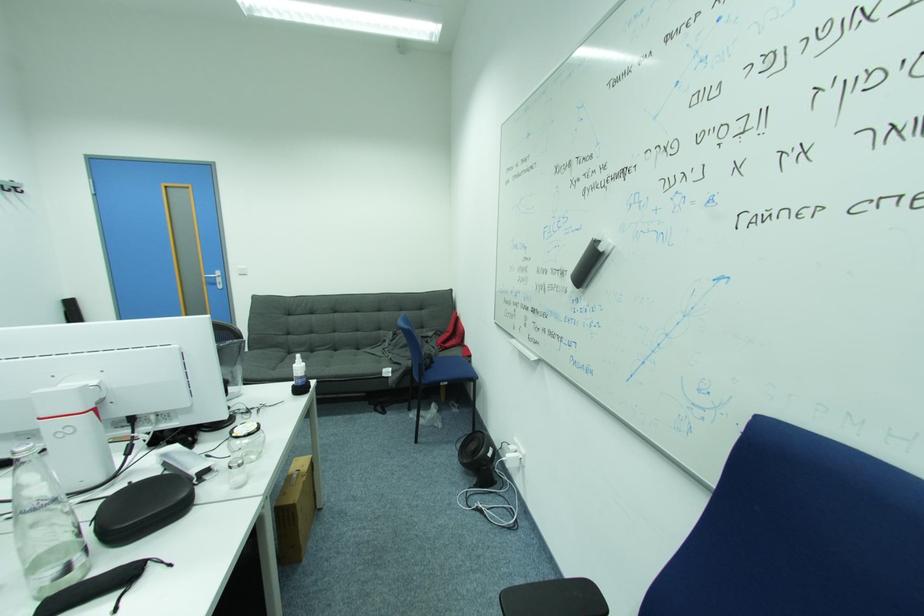
The location [44,525] corresponds to which object?

This point indicates the glass water bottle.